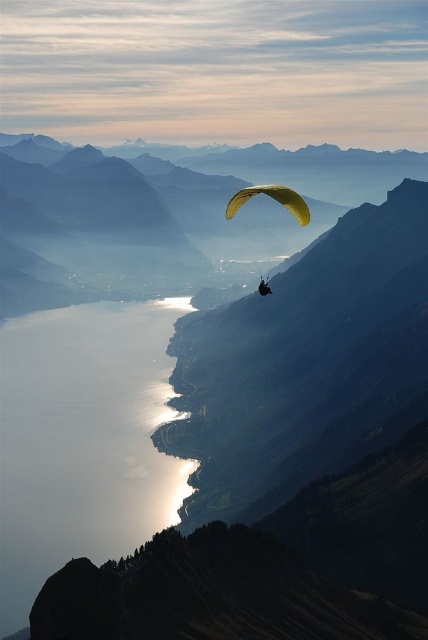
You are a paraglider pilot flying over a lake. You see a point marked at coordinates point (83, 440). Where is this point located?

The point (83, 440) is on the silvery reflective water at lower left.

You are a photographer trying to capture the paraglider from the lake below. Which object, the yellow fabric parachute at center or the matte yellow paraglider at center, would appear larger in your photo?

The yellow fabric parachute at center is taller than the matte yellow paraglider at center, so it would appear larger in the photo.

You are a paraglider pilot looking at the two points marked on your map. The points are labeled as point 1 at coordinates point (160, 355) and point 2 at coordinates point (267, 284). Which point is closer to your current position if you are directly above the paraglider?

Point 1 at coordinates point (160, 355) is closer to your current position because it is further to the viewer than point 2 at coordinates point (267, 284), which is further away.